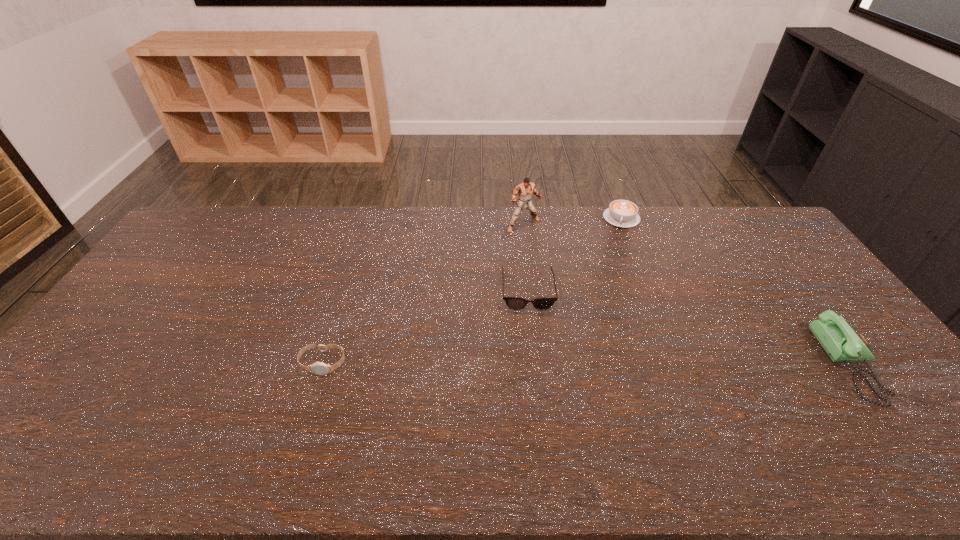
You are a GUI agent. You are given a task and a screenshot of the screen. Output one action in this format:
    pyautogui.click(x=<x>, y=<y>)
    Task: Click on the free space located 0.110m on the front lenses of the third nearest object
    
    Given the screenshot: What is the action you would take?
    pyautogui.click(x=531, y=339)

The image size is (960, 540). Identify the location of vacant space located on the front lenses of the third nearest object. pos(537,409).

You are a GUI agent. You are given a task and a screenshot of the screen. Output one action in this format:
    pyautogui.click(x=<x>, y=<y>)
    Task: Click on the vacant space located 0.090m on the front lenses of the third nearest object
    
    Given the screenshot: What is the action you would take?
    pyautogui.click(x=531, y=334)

I want to click on free region located on the side of the cappuccino with the handle, so click(x=616, y=248).

You are a GUI agent. You are given a task and a screenshot of the screen. Output one action in this format:
    pyautogui.click(x=<x>, y=<y>)
    Task: Click on the free spot located 0.270m on the side of the cappuccino with the handle
    The height and width of the screenshot is (540, 960).
    Given the screenshot: What is the action you would take?
    pyautogui.click(x=611, y=276)

You are a GUI agent. You are given a task and a screenshot of the screen. Output one action in this format:
    pyautogui.click(x=<x>, y=<y>)
    Task: Click on the vacant space positioned on the side of the cappuccino with the handle
    The image size is (960, 540).
    Given the screenshot: What is the action you would take?
    pyautogui.click(x=606, y=303)

Locate an element on the screen. The height and width of the screenshot is (540, 960). puncher situated at the far edge is located at coordinates (525, 189).

Where is `cappuccino that is at the far edge`? The image size is (960, 540). cappuccino that is at the far edge is located at coordinates (622, 213).

You are a GUI agent. You are given a task and a screenshot of the screen. Output one action in this format:
    pyautogui.click(x=<x>, y=<y>)
    Task: Click on the object located at the near edge
    The image size is (960, 540).
    Given the screenshot: What is the action you would take?
    click(838, 339)

This screenshot has height=540, width=960. Identify the location of object that is positioned at the right edge. (838, 339).